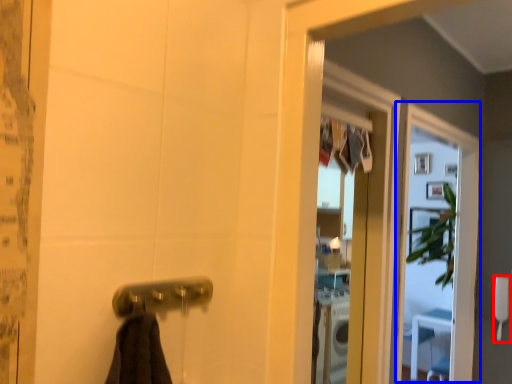
Question: Which point is further to the camera, towel bar (highlighted by a red box) or screen door (highlighted by a blue box)?

Choices:
 (A) towel bar
 (B) screen door

Answer: (A)